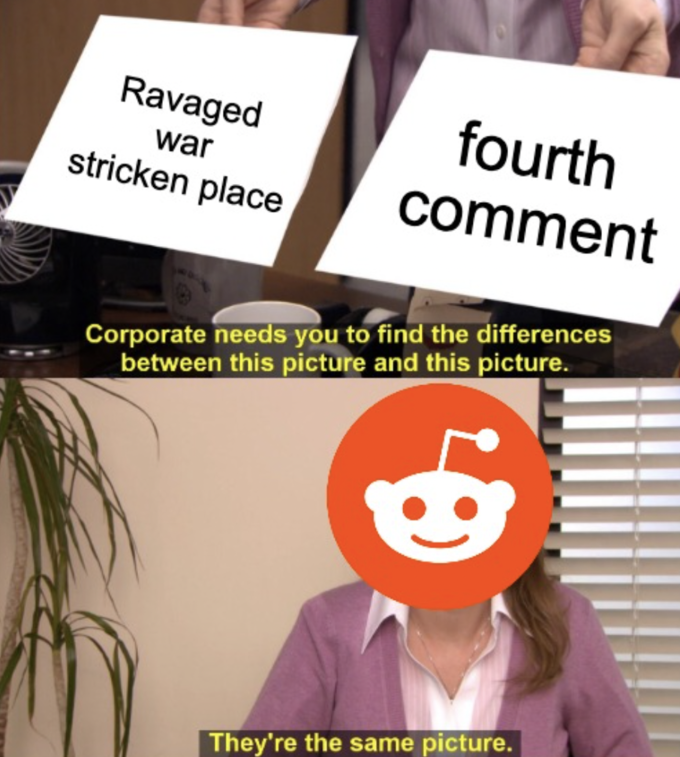
Where is `plant`? This screenshot has height=757, width=680. plant is located at coordinates (47, 486).